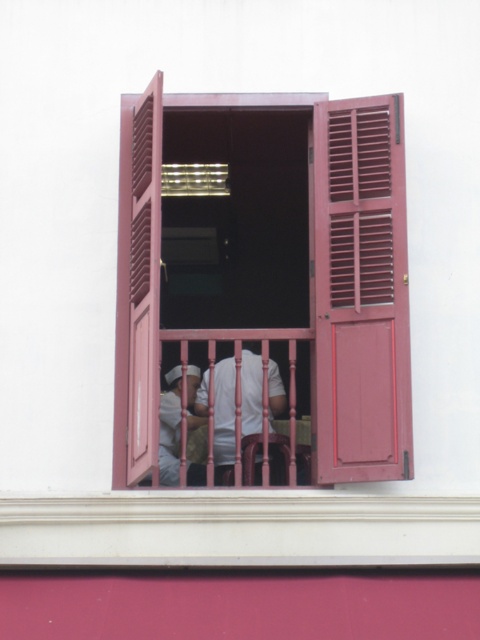
You are a guest in a room with a window that has open red shutters. You see a pink wooden rail at center and a white matte uniform at center. Which object is closer to you as you stand in front of the window?

The pink wooden rail at center is closer to you because it is in front of the white matte uniform at center.

You are standing in front of the window with deep red shutters. You want to place a small potted plant exactly at the center of the matte wood window at center. According to the coordinates provided, where should you place the plant?

The matte wood window at center is located at point [273,273], so you should place the small potted plant at those coordinates to position it exactly at the center of the matte wood window at center.